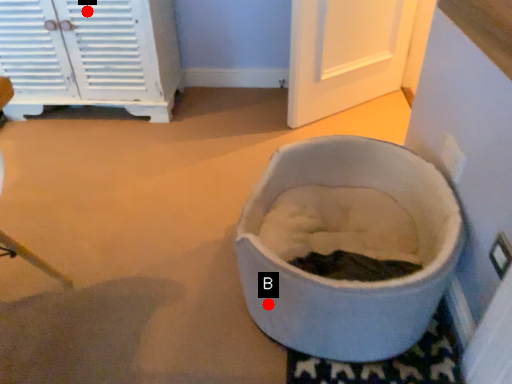
Question: Two points are circled on the image, labeled by A and B beside each circle. Which point appears farthest from the camera in this image?

Choices:
 (A) A is further
 (B) B is further

Answer: (A)